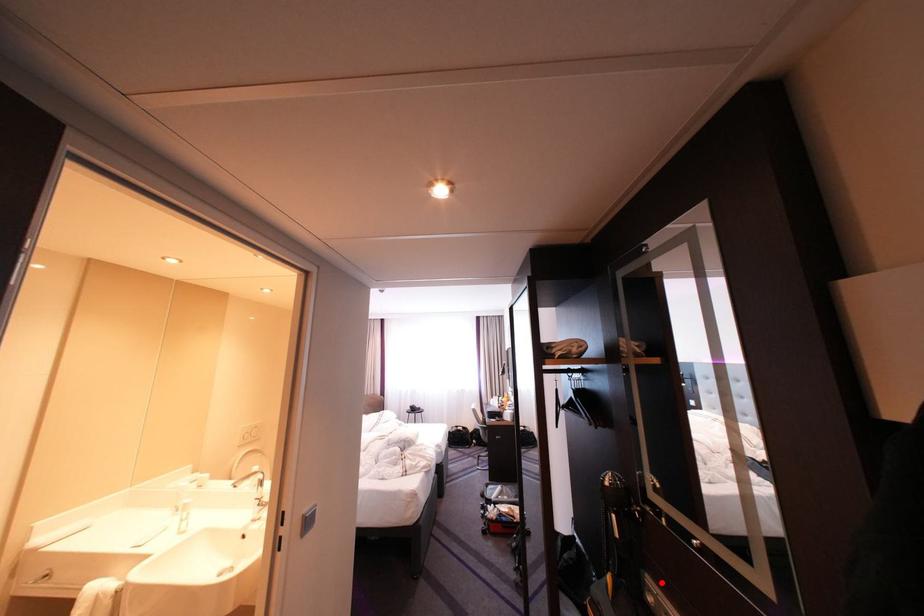
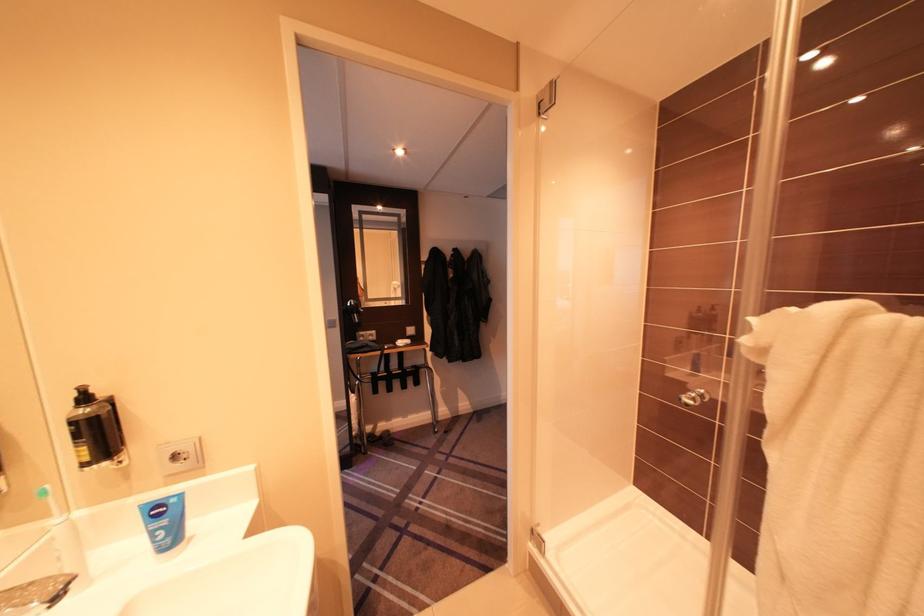
Question: I am providing you with two images of the same scene from different viewpoints. Image1 has a red point marked. In image2, the corresponding 3D location appears at what relative position? Reply with the corresponding letter.

Choices:
 (A) Closer
 (B) Farther

Answer: (A)